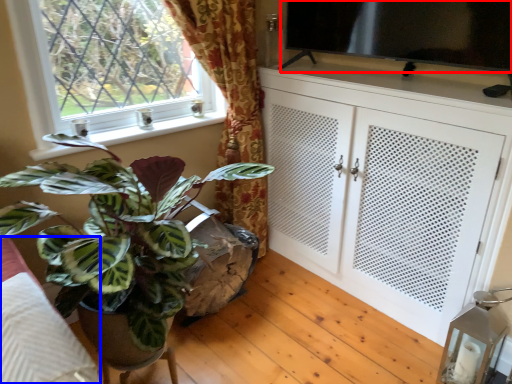
Question: Which of the following is the closest to the observer, window screen (highlighted by a red box) or bedding (highlighted by a blue box)?

Choices:
 (A) window screen
 (B) bedding

Answer: (B)